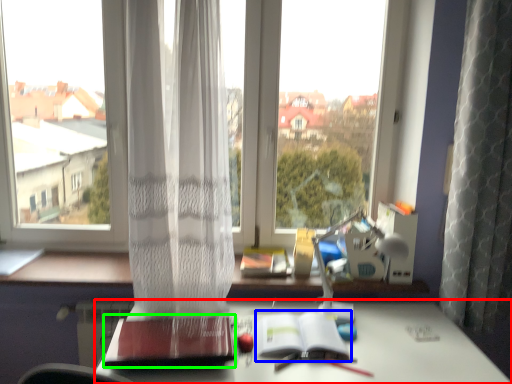
Question: Which object is positioned closest to desk (highlighted by a red box)? Select from paperback book (highlighted by a blue box) and paperback book (highlighted by a green box).

Choices:
 (A) paperback book
 (B) paperback book

Answer: (A)